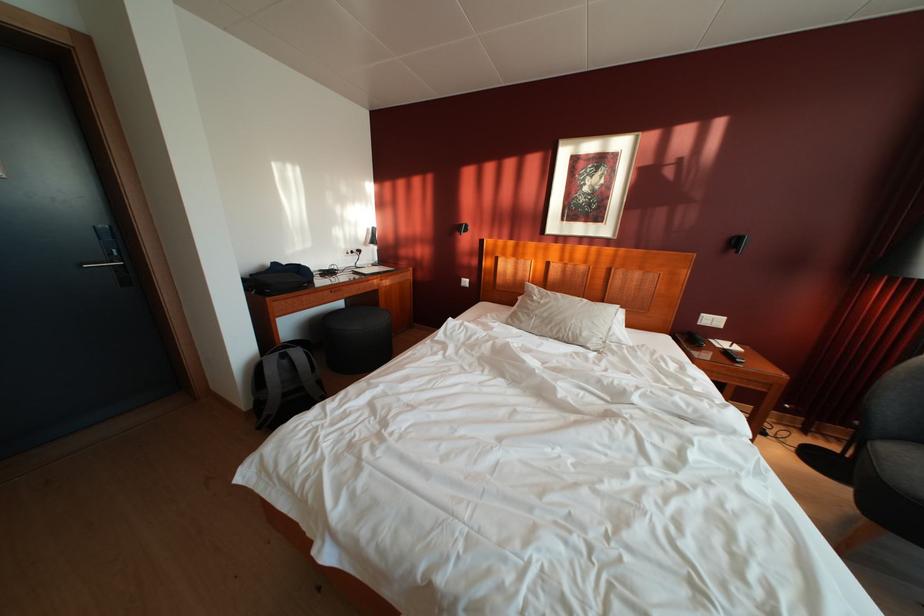
The location [278,278] corresponds to which object?

This point indicates the black bag.